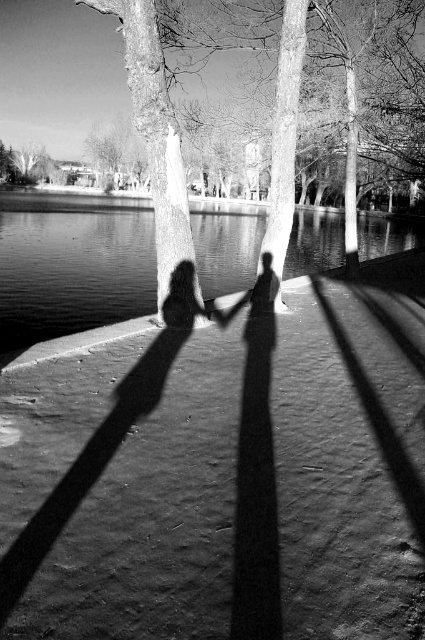
Question: Which object is the farthest from the smooth bark tree at upper center?

Choices:
 (A) smooth bark tree at upper left
 (B) smooth water at center

Answer: (A)

Question: Can you confirm if smooth water at center is positioned below smooth bark tree at upper left?

Choices:
 (A) yes
 (B) no

Answer: (A)

Question: Which object appears closest to the camera in this image?

Choices:
 (A) smooth bark tree at upper left
 (B) smooth bark tree at upper center

Answer: (B)

Question: Does smooth water at center appear over smooth bark tree at upper left?

Choices:
 (A) yes
 (B) no

Answer: (B)

Question: Can you confirm if smooth water at center is positioned to the left of smooth bark tree at upper center?

Choices:
 (A) yes
 (B) no

Answer: (A)

Question: Which of the following is the farthest from the observer?

Choices:
 (A) (105, 1)
 (B) (34, 166)

Answer: (B)